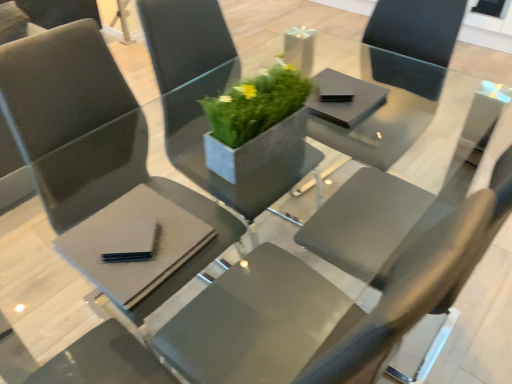
In order to face matte black table at center, should I rotate leftwards or rightwards?

It's best to rotate right around 15.909 degrees.

This screenshot has width=512, height=384. Describe the element at coordinates (397, 111) in the screenshot. I see `matte black table at center` at that location.

Describe the element at coordinates (263, 137) in the screenshot. The width and height of the screenshot is (512, 384). I see `green concrete planter at center` at that location.

Image resolution: width=512 pixels, height=384 pixels. What do you see at coordinates (343, 98) in the screenshot? I see `black matte napkin at center, marked as the first pad in a right-to-left arrangement` at bounding box center [343, 98].

In order to face matte gray chair at center, the 2th chair from the left, should I rotate leftwards or rightwards?

A 2.859 degree turn to the left will do.

What are the coordinates of `matte gray chair at center, placed as the first chair when sorted from right to left` in the screenshot? It's located at (208, 95).

This screenshot has height=384, width=512. Describe the element at coordinates (103, 167) in the screenshot. I see `matte gray chair at center, marked as the 2th chair in a right-to-left arrangement` at that location.

Find the location of a particular element. The width and height of the screenshot is (512, 384). matte black table at center is located at coordinates (397, 111).

From a real-world perspective, is black matte napkin at center, marked as the first pad in a right-to-left arrangement, located higher than matte gray chair at center, the 2th chair from the left?

Yes, from a real-world perspective, black matte napkin at center, marked as the first pad in a right-to-left arrangement, is on top of matte gray chair at center, the 2th chair from the left.

Considering the positions of point (345, 111) and point (314, 155), is point (345, 111) closer or farther from the camera than point (314, 155)?

Point (345, 111).

Is black matte pad at lower left, the second pad in the back-to-front sequence, surrounding black matte napkin at center, the 1th pad from the top?

Actually, black matte napkin at center, the 1th pad from the top, is outside black matte pad at lower left, the second pad in the back-to-front sequence.

Which is further, (117,231) or (365,111)?

The point (365,111) is behind.

Considering the relative sizes of black matte pad at lower left, marked as the 2th pad in a top-to-bottom arrangement, and black matte napkin at center, the 1th pad from the back, in the image provided, is black matte pad at lower left, marked as the 2th pad in a top-to-bottom arrangement, smaller than black matte napkin at center, the 1th pad from the back,?

Indeed, black matte pad at lower left, marked as the 2th pad in a top-to-bottom arrangement, has a smaller size compared to black matte napkin at center, the 1th pad from the back.

This screenshot has width=512, height=384. In the image, there is a black matte napkin at center, positioned as the second pad in front-to-back order. What are the coordinates of `pad below it (from the image's perspective)` in the screenshot? It's located at (130, 240).

Between black matte pad at lower left, arranged as the first pad when ordered from the bottom, and matte black table at center, which one has larger size?

Bigger between the two is matte black table at center.

Which object is wider, black matte pad at lower left, which appears as the second pad when viewed from the right, or matte black table at center?

matte black table at center is wider.

Between black matte pad at lower left, arranged as the first pad when ordered from the bottom, and matte black table at center, which one has less height?

black matte pad at lower left, arranged as the first pad when ordered from the bottom.

From the image's perspective, is black matte pad at lower left, marked as the 2th pad in a top-to-bottom arrangement, located above matte black table at center?

No, from the image's perspective, black matte pad at lower left, marked as the 2th pad in a top-to-bottom arrangement, is not on top of matte black table at center.

Which point is more forward, (182, 263) or (264, 74)?

The point (182, 263) is closer to the camera.

From the image's perspective, is matte gray chair at center, marked as the 2th chair in a right-to-left arrangement, above or below green concrete planter at center?

Based on their image positions, matte gray chair at center, marked as the 2th chair in a right-to-left arrangement, is located beneath green concrete planter at center.

Is matte gray chair at center, marked as the 2th chair in a right-to-left arrangement, positioned in front of green concrete planter at center?

Yes, the depth of matte gray chair at center, marked as the 2th chair in a right-to-left arrangement, is less than that of green concrete planter at center.

The height and width of the screenshot is (384, 512). What are the coordinates of `round table behind the green concrete planter at center` in the screenshot? It's located at (397, 111).

Considering the positions of objects matte black table at center and green concrete planter at center in the image provided, who is in front, matte black table at center or green concrete planter at center?

green concrete planter at center is closer to the camera.

Considering the sizes of objects matte black table at center and green concrete planter at center in the image provided, who is wider, matte black table at center or green concrete planter at center?

Wider between the two is matte black table at center.

What's the angular difference between matte black table at center and green concrete planter at center's facing directions?

94.6 degrees.

From a real-world perspective, which pad is the 2nd one underneath the green concrete planter at center? Please provide its 2D coordinates.

[(130, 240)]

From a real-world perspective, is green concrete planter at center located beneath black matte pad at lower left, marked as the 2th pad in a top-to-bottom arrangement?

No.

Is green concrete planter at center far away from black matte pad at lower left, marked as the 2th pad in a top-to-bottom arrangement?

No.

Which is more to the right, green concrete planter at center or black matte pad at lower left, which appears as the second pad when viewed from the right?

green concrete planter at center is more to the right.

Which is more to the right, matte gray chair at center, the 2th chair from the left, or black matte pad at lower left, which appears as the second pad when viewed from the right?

From the viewer's perspective, matte gray chair at center, the 2th chair from the left, appears more on the right side.

How many degrees apart are the facing directions of matte gray chair at center, placed as the first chair when sorted from right to left, and black matte pad at lower left, marked as the 2th pad in a top-to-bottom arrangement?

136 degrees separate the facing orientations of matte gray chair at center, placed as the first chair when sorted from right to left, and black matte pad at lower left, marked as the 2th pad in a top-to-bottom arrangement.

From a real-world perspective, is matte gray chair at center, the 2th chair from the left, physically below black matte pad at lower left, marked as the 2th pad in a top-to-bottom arrangement?

Yes, from a real-world perspective, matte gray chair at center, the 2th chair from the left, is below black matte pad at lower left, marked as the 2th pad in a top-to-bottom arrangement.

At what (x,y) coordinates should I click in order to perform the action: click on chair that is the 1st object located below the black matte napkin at center, which is the second pad in left-to-right order (from the image's perspective). Please return your answer as a coordinate pair (x, y). This screenshot has width=512, height=384. Looking at the image, I should click on (208, 95).

What are the coordinates of `pad that appears in front of the black matte napkin at center, positioned as the second pad in front-to-back order` in the screenshot? It's located at (130, 240).

From the image, which object appears to be nearer to black matte pad at lower left, which appears as the first pad when viewed from the left, matte gray chair at center, marked as the 2th chair in a right-to-left arrangement, or black matte napkin at center, marked as the first pad in a right-to-left arrangement?

Based on the image, matte gray chair at center, marked as the 2th chair in a right-to-left arrangement, appears to be nearer to black matte pad at lower left, which appears as the first pad when viewed from the left.

From the image, which object appears to be farther from black matte pad at lower left, which appears as the second pad when viewed from the right, green concrete planter at center or black matte napkin at center, which is the second pad in left-to-right order?

Based on the image, black matte napkin at center, which is the second pad in left-to-right order, appears to be further to black matte pad at lower left, which appears as the second pad when viewed from the right.

Based on their spatial positions, is matte gray chair at center, placed as the first chair when sorted from right to left, or green concrete planter at center further from black matte napkin at center, the 1th pad from the top?

Based on the image, matte gray chair at center, placed as the first chair when sorted from right to left, appears to be further to black matte napkin at center, the 1th pad from the top.

Based on their spatial positions, is matte gray chair at center, placed as the 1th chair when sorted from left to right, or black matte napkin at center, which is the second pad in left-to-right order, further from matte black table at center?

matte gray chair at center, placed as the 1th chair when sorted from left to right.

In the scene shown: When comparing their distances from matte gray chair at center, the 2th chair from the left, does matte black table at center or black matte napkin at center, marked as the first pad in a right-to-left arrangement, seem further?

matte black table at center.

Considering their positions, is matte gray chair at center, placed as the first chair when sorted from right to left, positioned closer to matte black table at center than black matte pad at lower left, the second pad in the back-to-front sequence?

matte gray chair at center, placed as the first chair when sorted from right to left, lies closer to matte black table at center than the other object.

Consider the image. From the image, which object appears to be nearer to black matte pad at lower left, which appears as the first pad when viewed from the left, matte black table at center or matte gray chair at center, placed as the 1th chair when sorted from left to right?

matte gray chair at center, placed as the 1th chair when sorted from left to right, is positioned closer to the anchor black matte pad at lower left, which appears as the first pad when viewed from the left.

Considering their positions, is green concrete planter at center positioned further to matte gray chair at center, marked as the 2th chair in a right-to-left arrangement, than matte black table at center?

matte black table at center is positioned further to the anchor matte gray chair at center, marked as the 2th chair in a right-to-left arrangement.

Where is `pad located between matte gray chair at center, the 2th chair from the left, and matte black table at center in the left-right direction`? The width and height of the screenshot is (512, 384). pad located between matte gray chair at center, the 2th chair from the left, and matte black table at center in the left-right direction is located at coordinates (343, 98).

Locate an element on the screen. This screenshot has height=384, width=512. chair situated between matte gray chair at center, placed as the 1th chair when sorted from left to right, and matte black table at center from left to right is located at coordinates (208, 95).

You are a GUI agent. You are given a task and a screenshot of the screen. Output one action in this format:
    pyautogui.click(x=<x>, y=<y>)
    Task: Click on the houseplant between matte gray chair at center, the 2th chair from the left, and matte black table at center, in the horizontal direction
    
    Given the screenshot: What is the action you would take?
    pyautogui.click(x=263, y=137)

Locate an element on the screen. pad between matte gray chair at center, placed as the 1th chair when sorted from left to right, and green concrete planter at center is located at coordinates (130, 240).